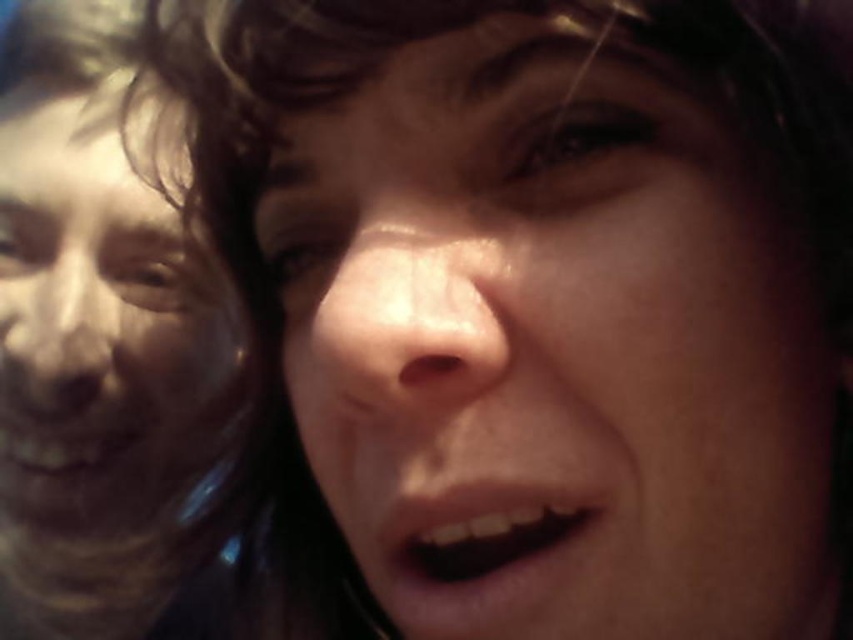
Consider the image. Can you confirm if smooth skin face at center is shorter than smooth skin face at left?

Yes, smooth skin face at center is shorter than smooth skin face at left.

Who is taller, smooth skin face at center or smooth skin face at left?

Standing taller between the two is smooth skin face at left.

Is point (370, 253) positioned behind point (212, 308)?

No, (370, 253) is closer to viewer.

What are the coordinates of `smooth skin face at center` in the screenshot? It's located at (556, 340).